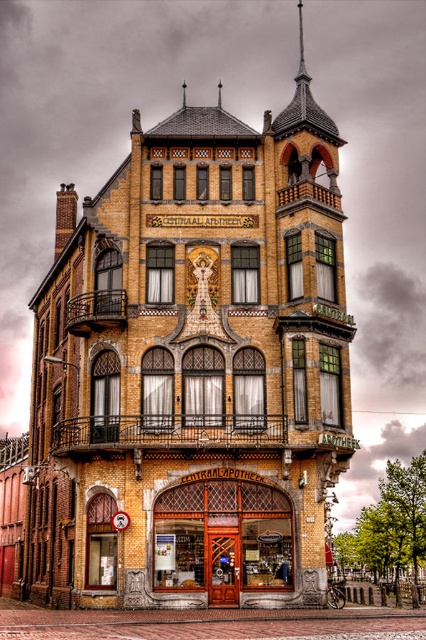
Which is in front, point (181, 564) or point (127, 515)?

Point (181, 564)

Is wooden door at center thinner than metallic clock face at center?

No.

Is point (226, 474) positioned before point (118, 518)?

No.

Find the location of a particular element. The image size is (426, 640). wooden door at center is located at coordinates (221, 536).